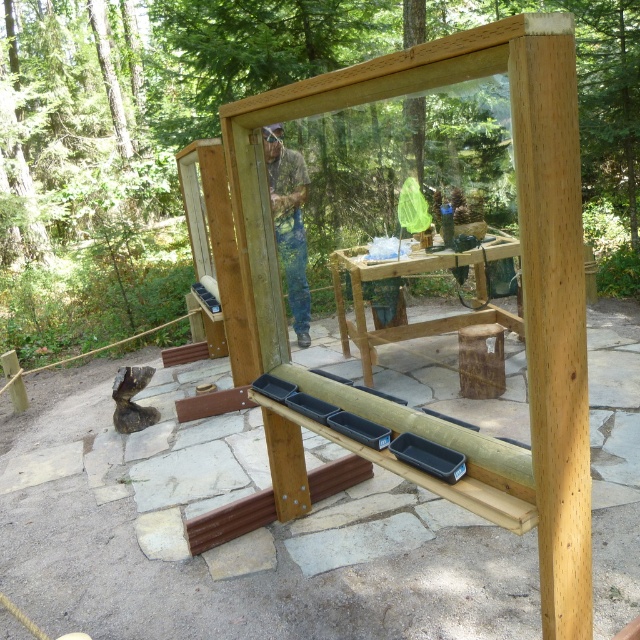
You are standing in front of the wooden structure in the image. Where is the natural wood frame at center located in relation to the forested background?

The natural wood frame at center is located at point [515,330], which is in the central lower portion of the image, closer to the forested background.

You are a hiker who has spotted both the natural wood frame at center and the camouflage fabric shirt at center in the image. Which object is positioned lower in the scene?

The natural wood frame at center is positioned lower than the camouflage fabric shirt at center in the scene.